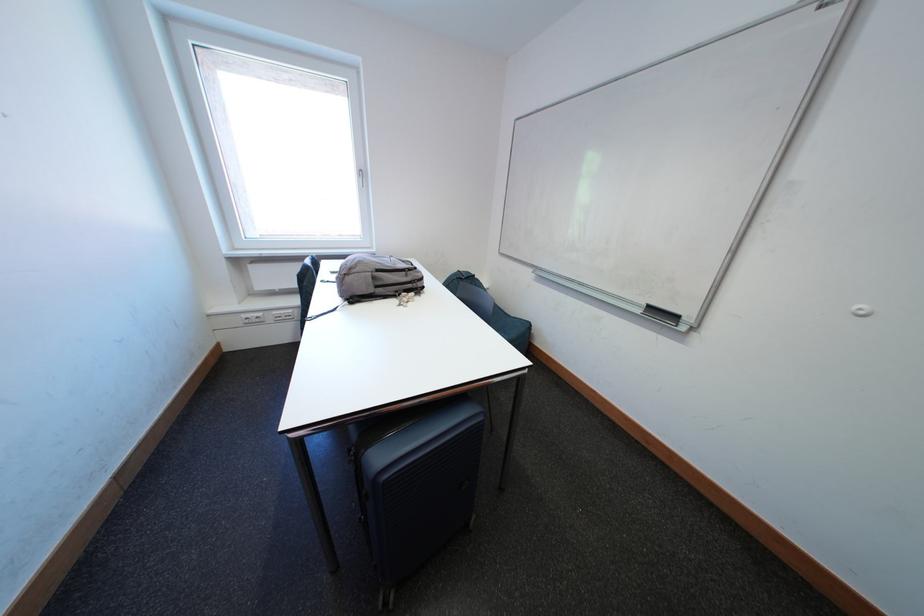
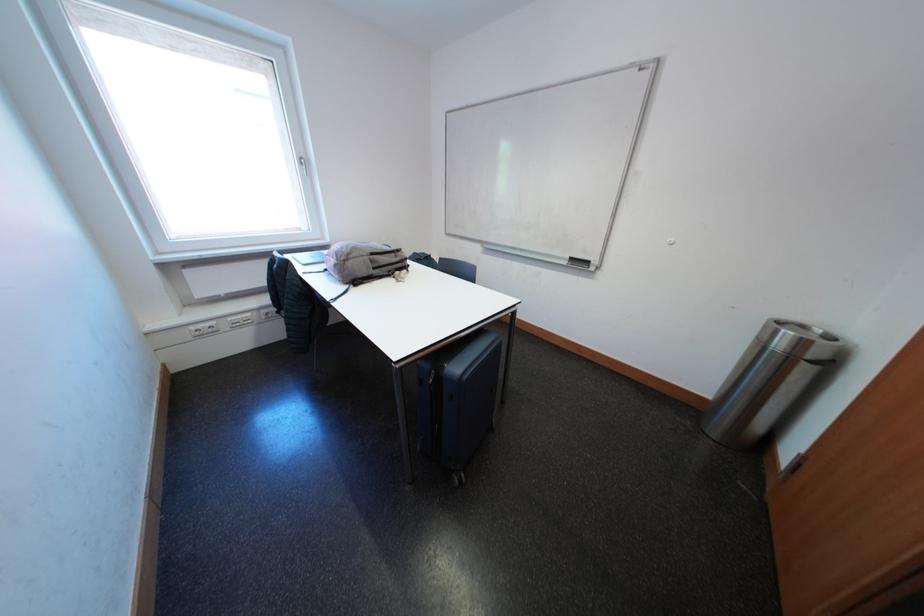
Locate, in the second image, the point that corresponds to (649,315) in the first image.

(575, 267)